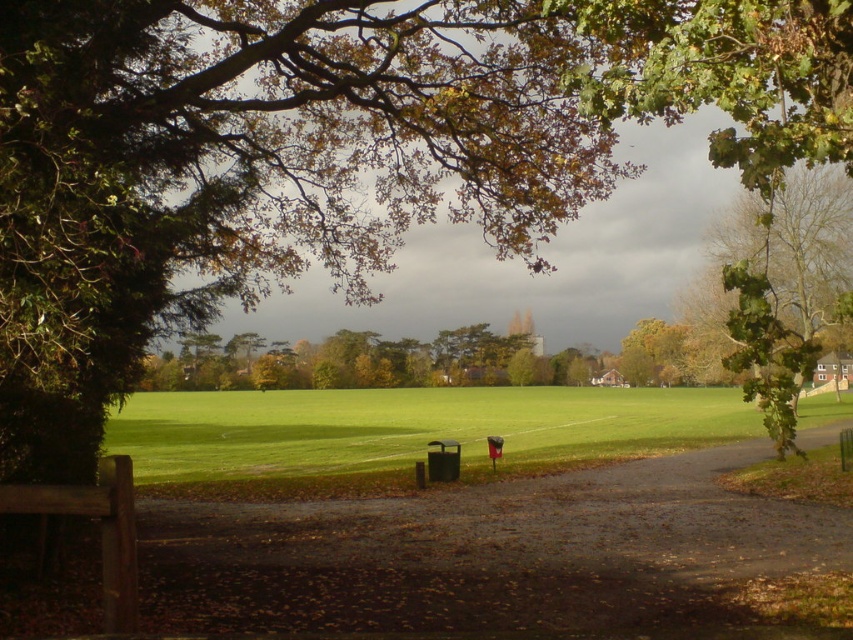
Between green grassy field at center and green leafy tree at upper right, which one appears on the right side from the viewer's perspective?

From the viewer's perspective, green leafy tree at upper right appears more on the right side.

Does green grassy field at center appear over green leafy tree at upper right?

No.

What do you see at coordinates (410, 428) in the screenshot? I see `green grassy field at center` at bounding box center [410, 428].

This screenshot has height=640, width=853. I want to click on green grassy field at center, so click(410, 428).

Can you confirm if green leafy tree at upper center is shorter than green leafy tree at upper right?

Incorrect, green leafy tree at upper center's height does not fall short of green leafy tree at upper right's.

Does green leafy tree at upper center appear over green leafy tree at upper right?

Yes, green leafy tree at upper center is above green leafy tree at upper right.

Which is behind, point (109, 22) or point (763, 326)?

The point (109, 22) is more distant.

Identify the location of green leafy tree at upper center. The width and height of the screenshot is (853, 640). (248, 170).

Which is below, green leafy tree at upper center or wooden bench at lower left?

wooden bench at lower left is below.

Does point (608, 160) come closer to viewer compared to point (13, 506)?

No.

Image resolution: width=853 pixels, height=640 pixels. Identify the location of green leafy tree at upper center. (248, 170).